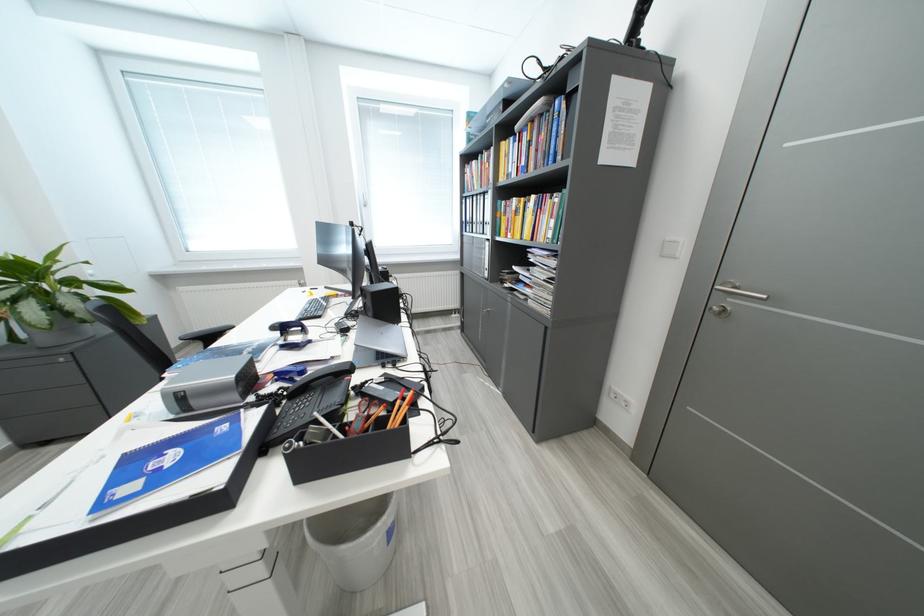
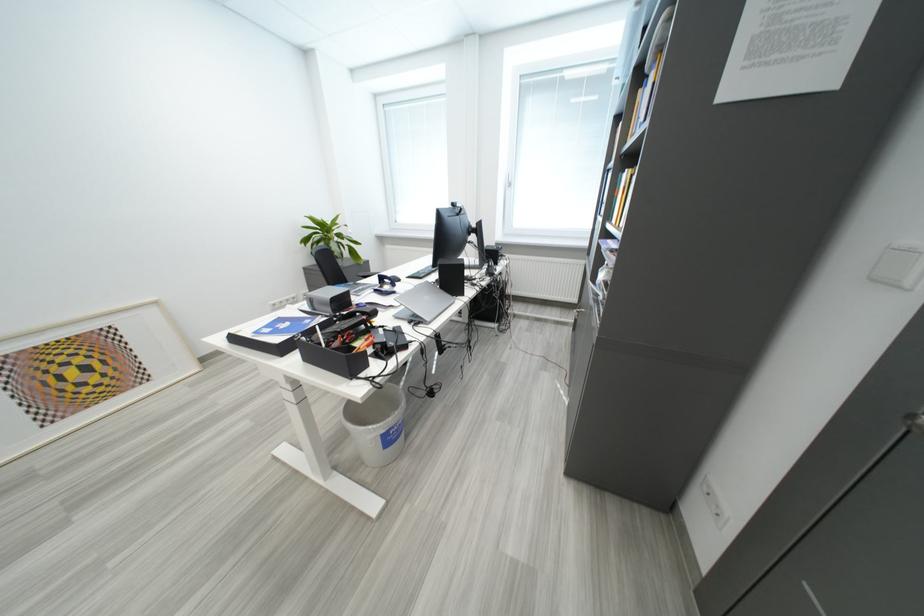
Where in the second image is the point corresponding to the point at 631,416 from the first image?

(718, 525)